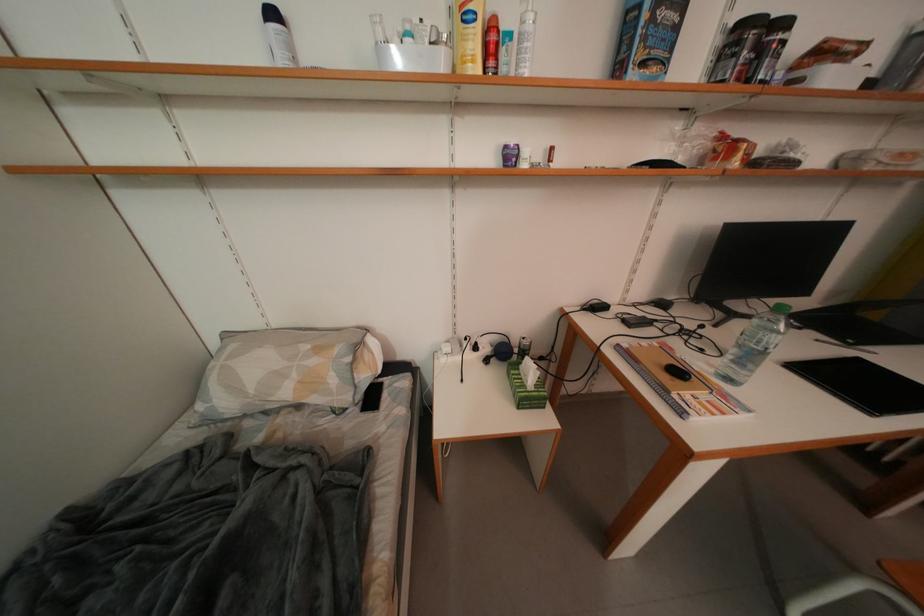
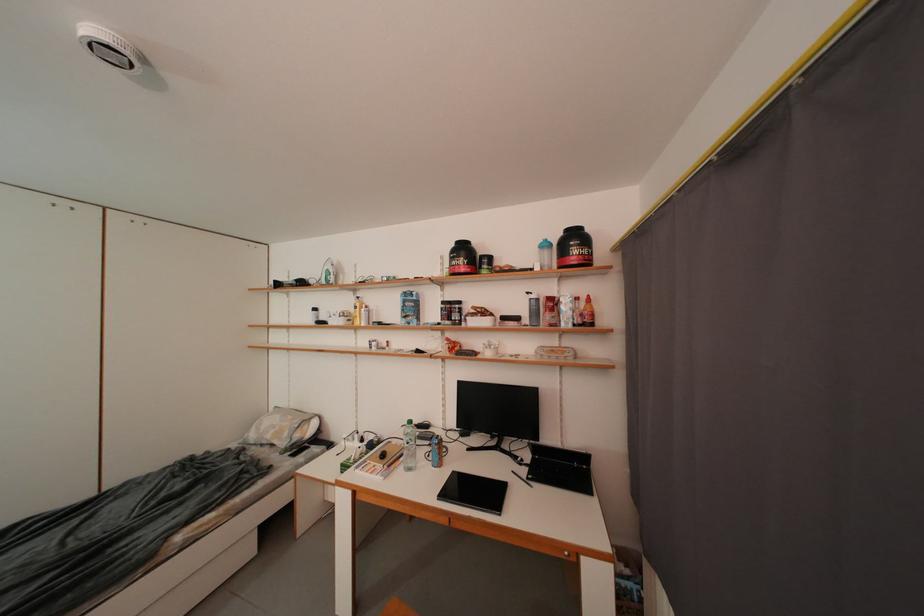
The point at (749, 164) is marked in the first image. Where is the corresponding point in the second image?

(457, 355)